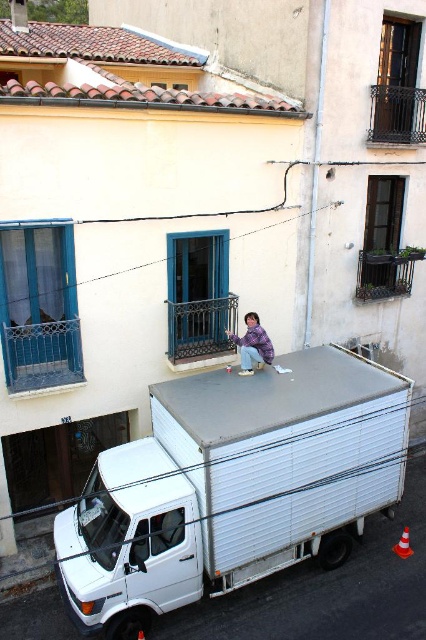
Can you confirm if white matte truck at center is smaller than purple fabric at center?

Actually, white matte truck at center might be larger than purple fabric at center.

Find the location of `white matte truck at center`. white matte truck at center is located at coordinates (233, 486).

Which of these two, white matte truck at center or white matte van at lower left, stands taller?

With more height is white matte truck at center.

How much distance is there between white matte truck at center and white matte van at lower left?

They are 27.36 inches apart.

Who is more forward, (x=184, y=381) or (x=170, y=492)?

Point (x=170, y=492) is in front.

The width and height of the screenshot is (426, 640). Identify the location of white matte truck at center. (233, 486).

Is point (114, 538) positioned after point (244, 337)?

No, (114, 538) is closer to viewer.

Between white matte van at lower left and purple fabric at center, which one is positioned lower?

white matte van at lower left is below.

Who is more distant from viewer, (180, 531) or (241, 339)?

Point (241, 339)

Identify the location of white matte van at lower left. The height and width of the screenshot is (640, 426). (129, 541).